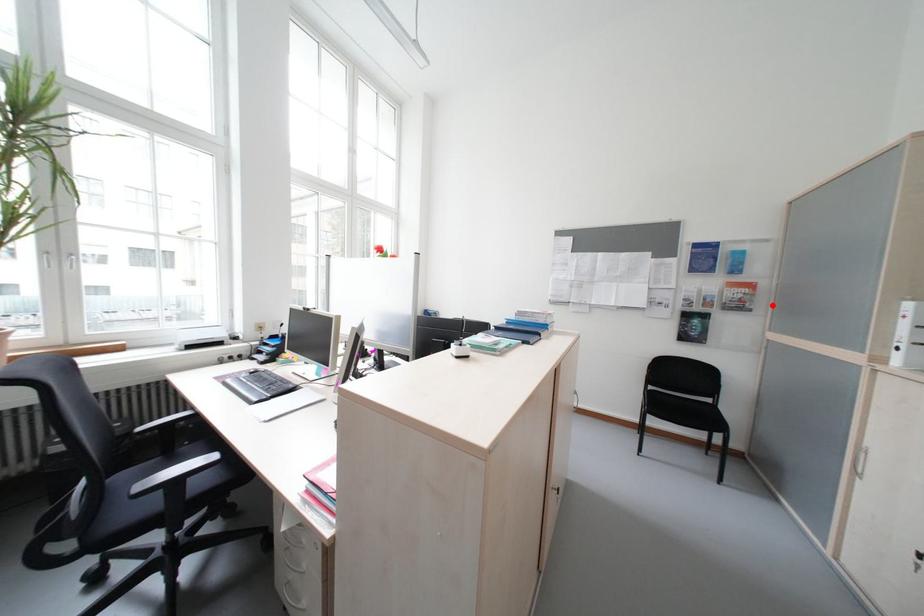
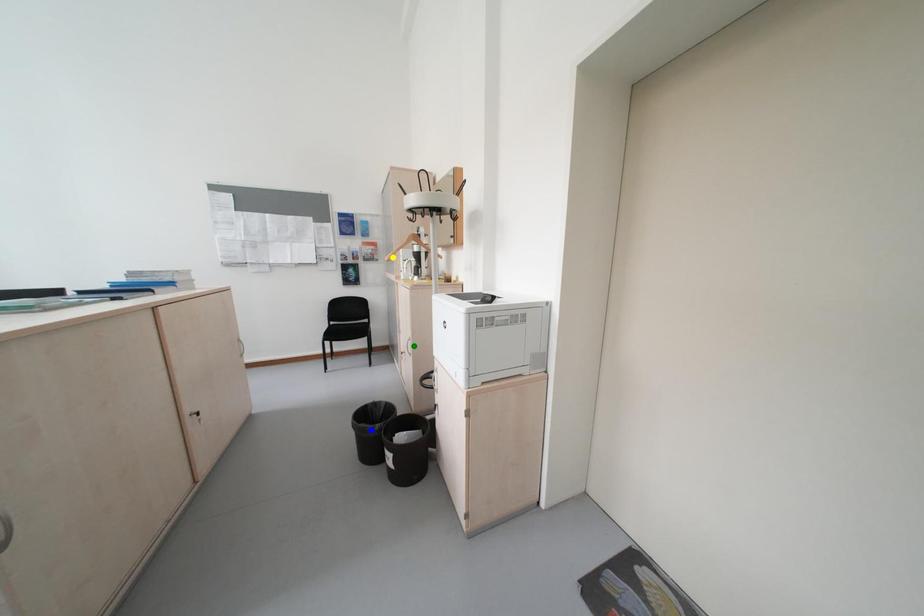
Question: I am providing you with two images of the same scene from different viewpoints. A red point is marked on the first image. You are given multiple points on the second image. Which spot in image 2 lines up with the point in image 1?

Choices:
 (A) blue point
 (B) yellow point
 (C) green point

Answer: (B)